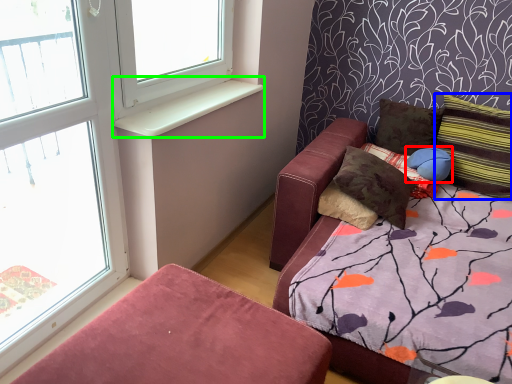
Question: Considering the real-world distances, which object is farthest from pillow (highlighted by a red box)? pillow (highlighted by a blue box) or window sill (highlighted by a green box)?

Choices:
 (A) pillow
 (B) window sill

Answer: (B)